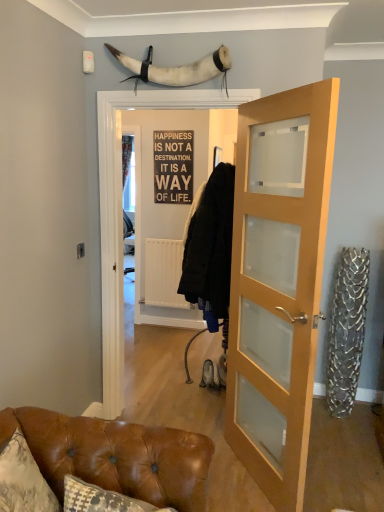
Where is `blank space above white fur horn at upper center (from a real-world perspective)`? blank space above white fur horn at upper center (from a real-world perspective) is located at coordinates (175, 38).